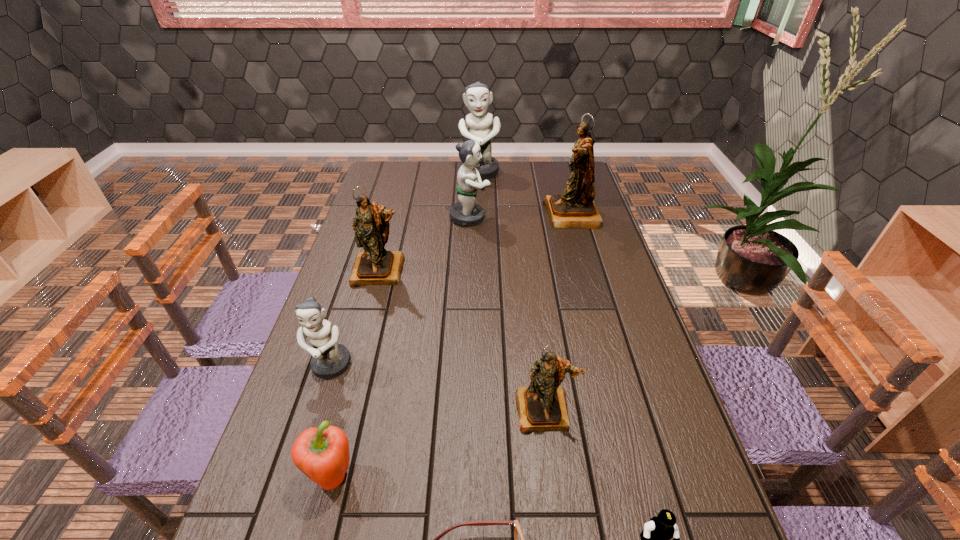
Locate which green figurine is the second closest to the biggest gold figurine. Please provide its 2D coordinates. Your answer should be formatted as a tuple, i.e. [(x, y)], where the tuple contains the x and y coordinates of a point satisfying the conditions above.

[(466, 212)]

Where is `green figurine that is the second closest to the farthest gold figurine`? Image resolution: width=960 pixels, height=540 pixels. green figurine that is the second closest to the farthest gold figurine is located at coordinates (466, 212).

In order to click on gold figurine that stands as the second closest to the second shortest object in this screenshot , I will do `click(375, 266)`.

Choose which gold figurine is the third nearest neighbor to the shortest object. Please provide its 2D coordinates. Your answer should be formatted as a tuple, i.e. [(x, y)], where the tuple contains the x and y coordinates of a point satisfying the conditions above.

[(575, 208)]

This screenshot has height=540, width=960. Identify the location of free location that satisfies the following two spatial constraints: 1. on the front-facing side of the farthest gold figurine; 2. on the front-facing side of the second nearest gold figurine. 588,271.

What are the coordinates of `free space that satisfies the following two spatial constraints: 1. on the front-facing side of the biggest gold figurine; 2. on the front-facing side of the smallest gold figurine` in the screenshot? It's located at (628, 410).